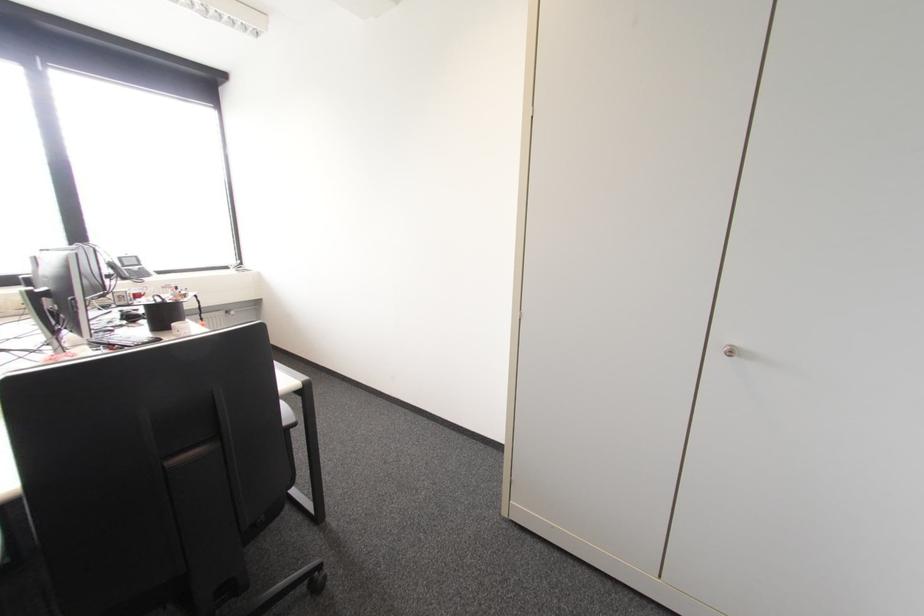
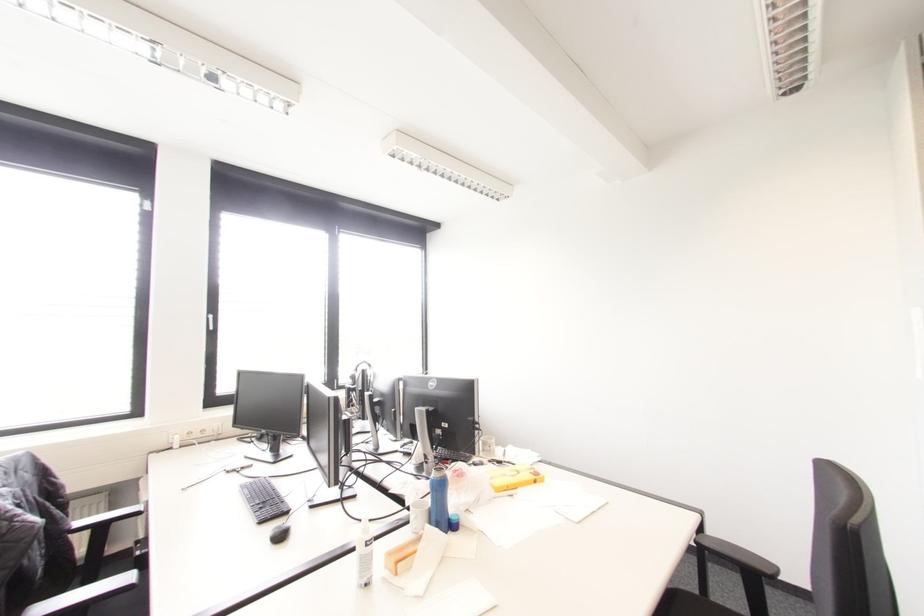
Question: Which direction would the cameraman need to move to produce the second image? Reply with the corresponding letter.

Choices:
 (A) Left
 (B) Right
 (C) Forward
 (D) Backward

Answer: (A)